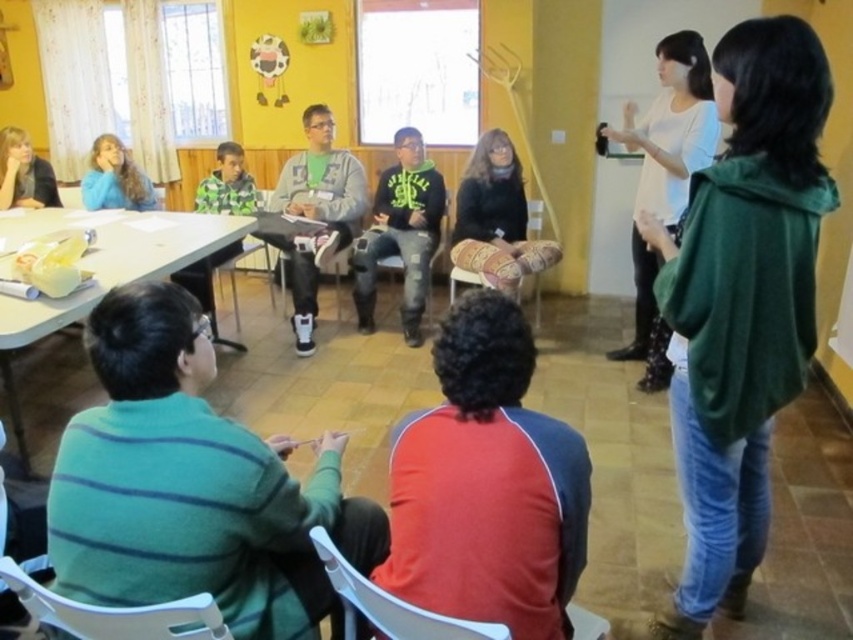
You are standing in the room and want to take a photo of both point (349, 180) and point (538, 221). Which point will appear larger in your photo?

Point (349, 180) is closer to the camera than point (538, 221), so it will appear larger in the photo.

You are a photographer trying to capture a candid shot of the green matte hoodie at center and the white plastic chair at lower left. Since you want to ensure both subjects are in focus, you need to know their heights. Can you determine which one is taller?

The green matte hoodie at center is much taller than the white plastic chair at lower left, so the photographer should focus on the height of the green matte hoodie at center to ensure both are in focus.